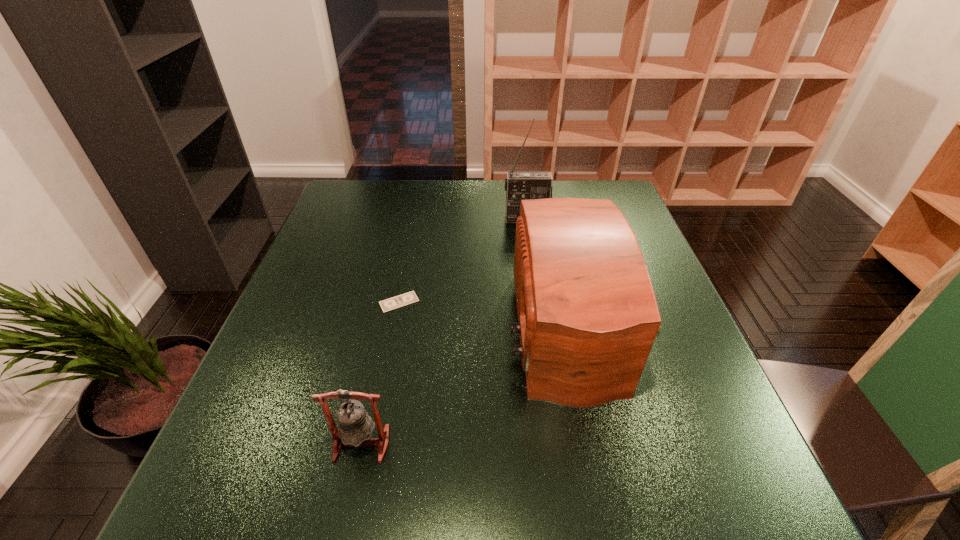
Where is `the tallest object`? the tallest object is located at coordinates 519,186.

Find the location of a particular element. the taller radio receiver is located at coordinates (519, 186).

This screenshot has height=540, width=960. I want to click on the third shortest object, so click(x=587, y=313).

In order to click on the nearer radio receiver in this screenshot , I will do `click(587, 313)`.

At what (x,y) coordinates should I click in order to perform the action: click on bell. Please return your answer as a coordinate pair (x, y). This screenshot has height=540, width=960. Looking at the image, I should click on (355, 426).

Identify the location of the third tallest object. (355, 426).

Locate an element on the screen. The height and width of the screenshot is (540, 960). the shortest object is located at coordinates (408, 298).

Identify the location of vacant space located on the display of the tallest object. This screenshot has width=960, height=540. (538, 293).

Identify the location of free location located 0.310m on the front-facing side of the nearer radio receiver. This screenshot has width=960, height=540. (370, 327).

I want to click on vacant space located on the front-facing side of the nearer radio receiver, so click(x=441, y=327).